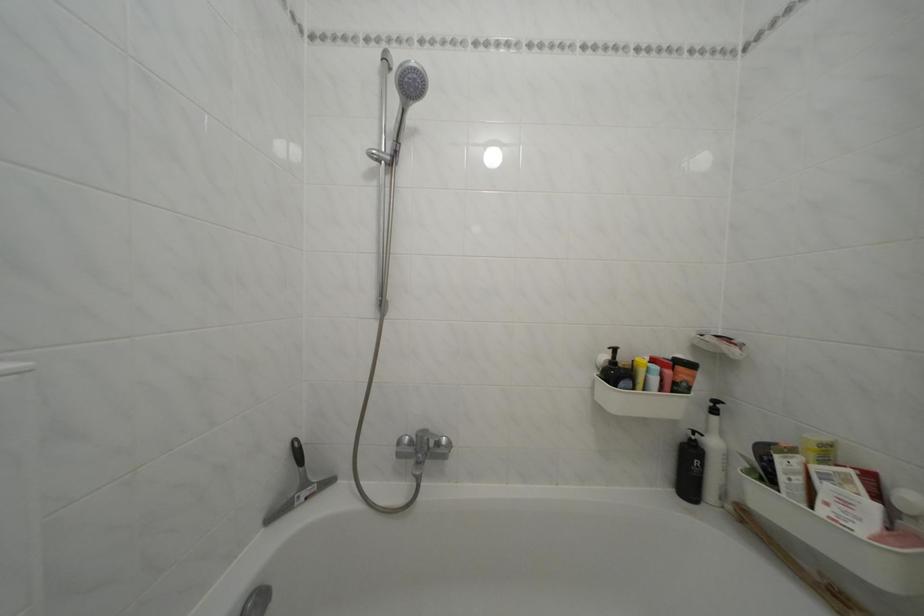
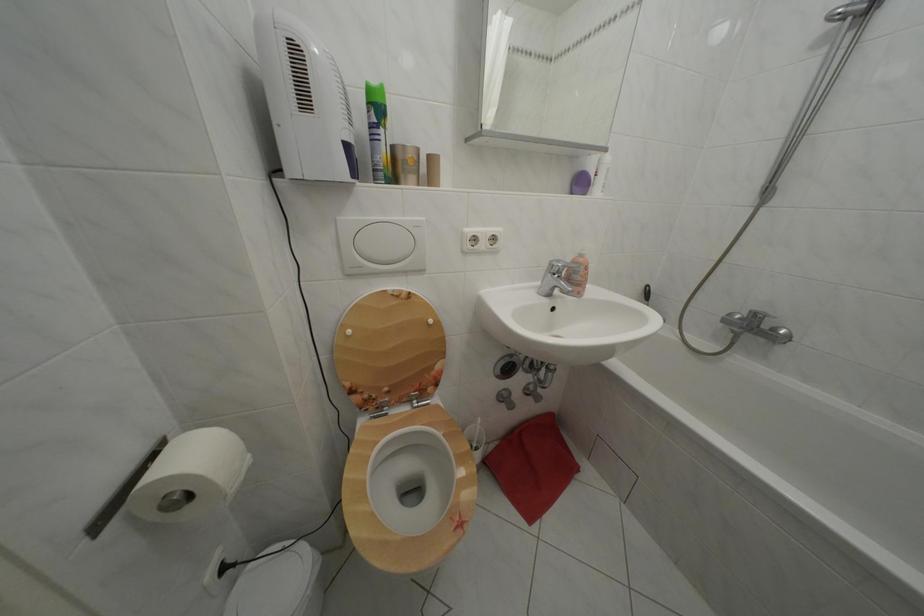
In the second image, find the point that corresponds to point (447, 450) in the first image.

(783, 336)